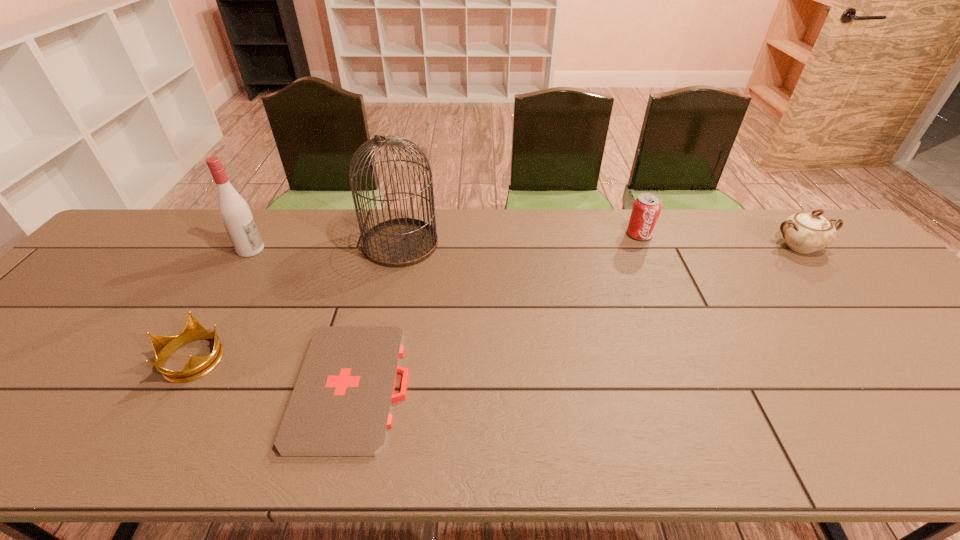
Identify the location of unoccupied position between the soda can and the alcohol. (445, 242).

Where is `free point between the crown and the alcohol`? The width and height of the screenshot is (960, 540). free point between the crown and the alcohol is located at coordinates (222, 304).

Identify the location of free space between the alcohol and the fifth object from left to right. Image resolution: width=960 pixels, height=540 pixels. (445, 242).

The width and height of the screenshot is (960, 540). In order to click on object that is the second closest one to the second object from right to left in this screenshot , I will do `click(401, 242)`.

Identify the location of the closest object to the fifth shortest object. The image size is (960, 540). (401, 242).